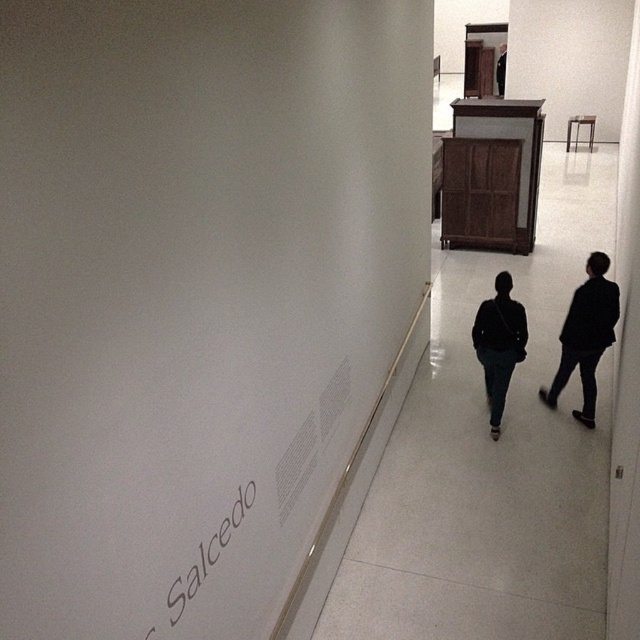
You are an art enthusiast visiting the gallery and want to take a photo of the Salcedo text panel. You notice two people wearing jackets in front of you. Which jacket is thinner between the dark fabric jacket at center and the black matte jacket at right?

The dark fabric jacket at center is thinner than the black matte jacket at right.

You are standing in the art gallery and want to locate the dark fabric jacket at center. Where exactly is it positioned in the image?

The dark fabric jacket at center is located at point (x=586, y=336) in the image.

You are an art gallery attendant and need to guide visitors to the restroom. There are two jackets left behind near the entrance. Which jacket is wider, the dark fabric jacket at center or the dark brown leather jacket at upper center?

The dark fabric jacket at center is wider than the dark brown leather jacket at upper center according to the description.